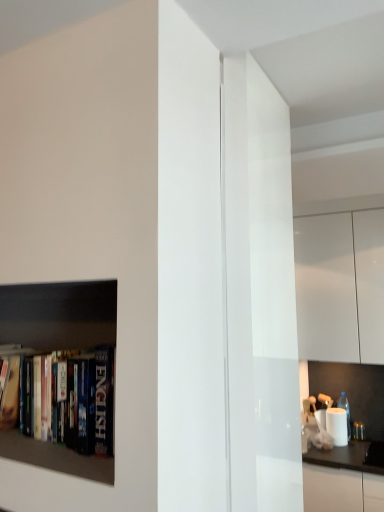
In order to face dark blue hardcover book at left, should I rotate leftwards or rightwards?

Turn left approximately 19.479 degrees to face it.

The height and width of the screenshot is (512, 384). What do you see at coordinates (74, 415) in the screenshot? I see `dark blue hardcover book at left` at bounding box center [74, 415].

You are a GUI agent. You are given a task and a screenshot of the screen. Output one action in this format:
    pyautogui.click(x=<x>, y=<y>)
    Task: Click on the dark blue hardcover book at left
    The image size is (384, 512).
    Given the screenshot: What is the action you would take?
    pyautogui.click(x=74, y=415)

Locate an element on the screen. dark blue hardcover book at left is located at coordinates (74, 415).